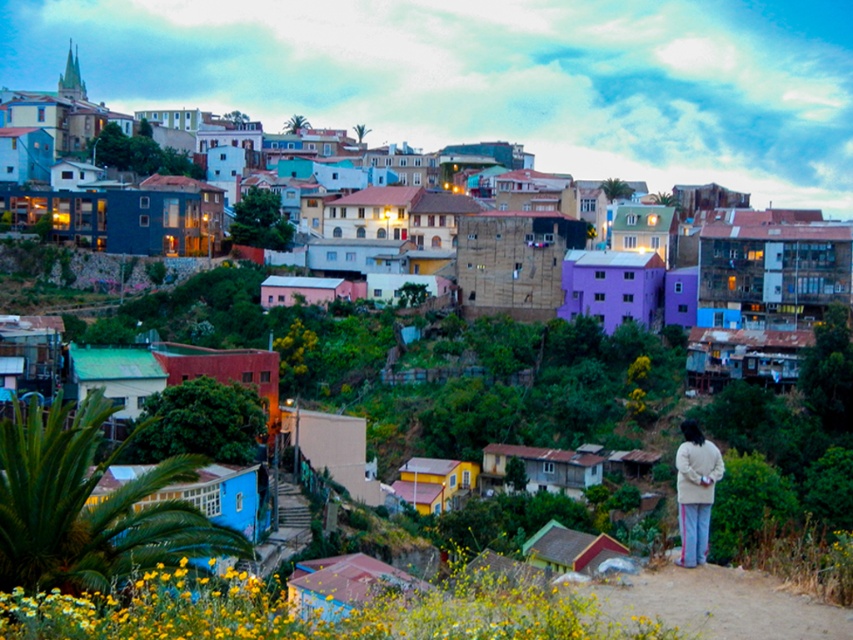
You are a photographer standing on the dirt path and want to capture both the vivid pastel houses at center and the light beige sweater at lower right in the same frame. Since the camera can only focus on one object at a time, which object should you focus on to ensure it appears larger in the photo?

You should focus on the vivid pastel houses at center because they are larger than the light beige sweater at lower right, so they will naturally appear bigger in the photo.

You are standing on the dirt path and want to take a photo of the vivid pastel houses at center and the light beige sweater at lower right. Which object should you focus on first if you want to capture both in a single frame without moving the camera?

You should focus on the vivid pastel houses at center first because it is positioned to the right of the light beige sweater at lower right, so adjusting the camera to include both would require ensuring the rightmost object is within the frame first.